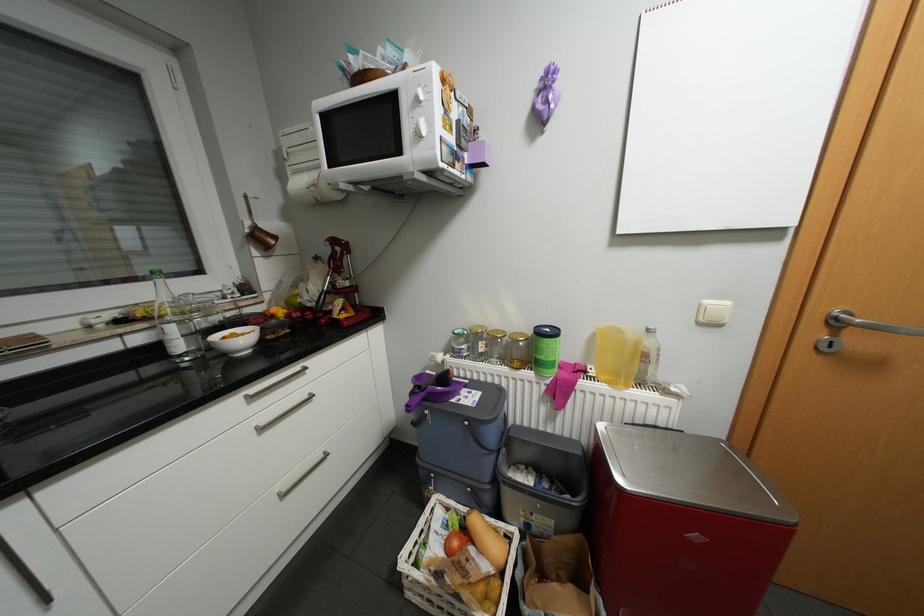
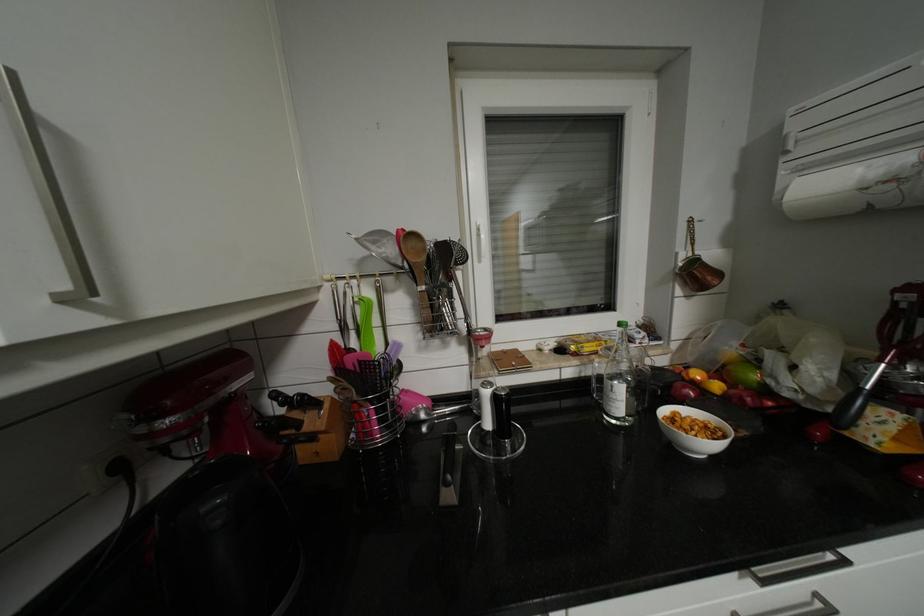
The point at (263, 227) is marked in the first image. Where is the corresponding point in the second image?

(702, 261)